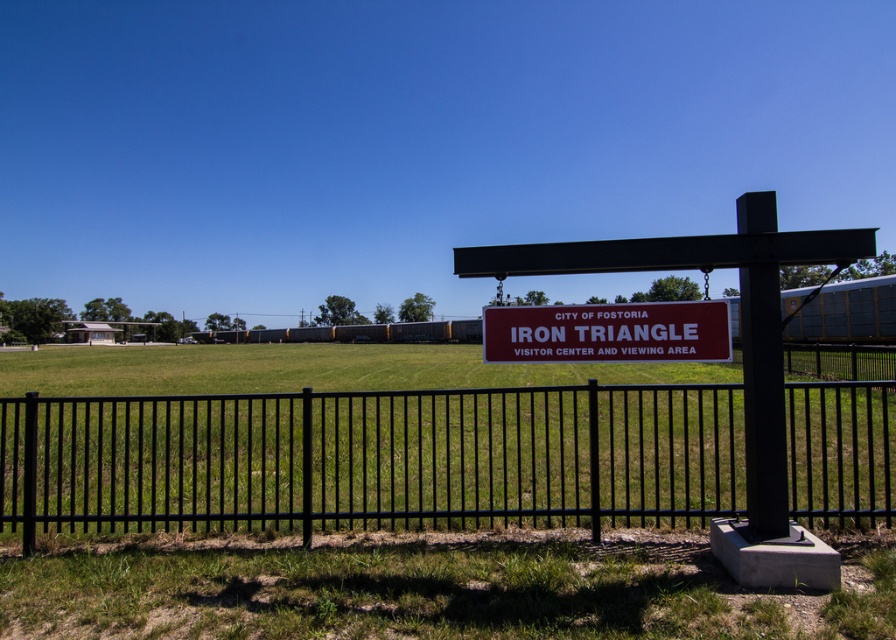
You are a tourist standing at the visitor center sign. You see a yellow corrugated metal train at center and a yellow corrugated metal passenger train at center. Which one is closer to the fence?

The yellow corrugated metal train at center is closer to the fence because it is positioned to the left of the yellow corrugated metal passenger train at center, and since the fence is in the foreground, objects closer to the left would be nearer to it.

You are a visitor standing at the viewing area. You see the black metal fence at center and the yellow corrugated metal train at center. Which object appears smaller in the image?

The black metal fence at center appears smaller than the yellow corrugated metal train at center in the image.

You are a visitor standing in front of the black metal fence at center and the matte red sign at center. Which object is taller?

The black metal fence at center is taller than the matte red sign at center.